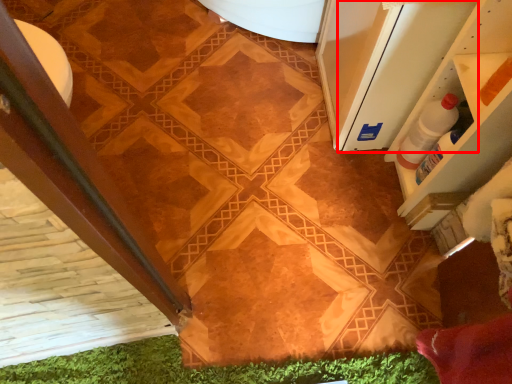
Question: From the image's perspective, where is screen door (annotated by the red box) located relative to bottle?

Choices:
 (A) above
 (B) below

Answer: (A)